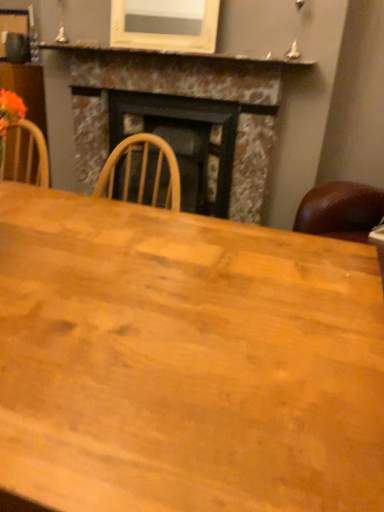
Question: Is marble fireplace at center bigger or smaller than wooden table at center?

Choices:
 (A) big
 (B) small

Answer: (A)

Question: From a real-world perspective, relative to wooden table at center, is marble fireplace at center vertically above or below?

Choices:
 (A) below
 (B) above

Answer: (B)

Question: Which object is positioned farthest from the wooden table at center?

Choices:
 (A) marble mantel at upper center
 (B) marble fireplace at center

Answer: (A)

Question: Considering the real-world distances, which object is closest to the wooden table at center?

Choices:
 (A) marble mantel at upper center
 (B) marble fireplace at center

Answer: (B)